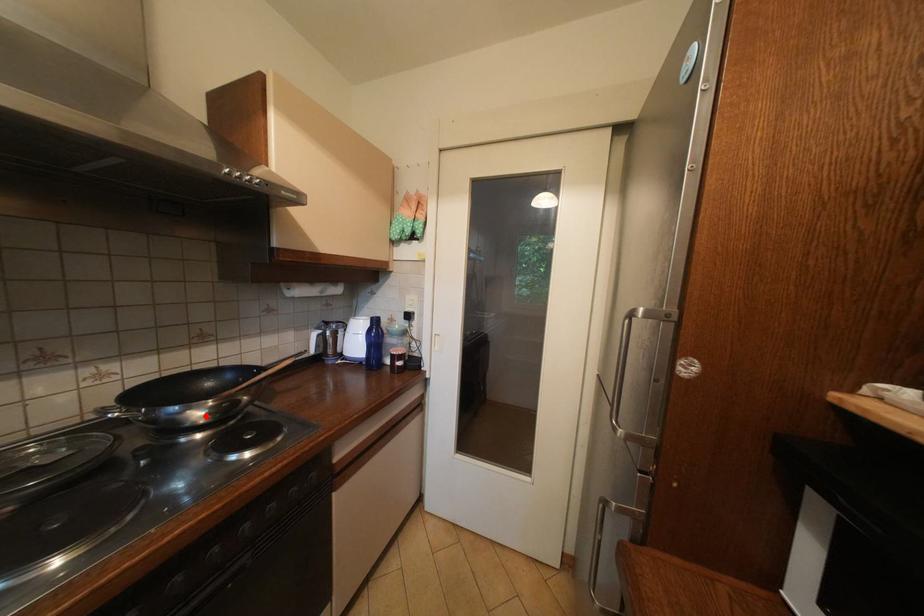
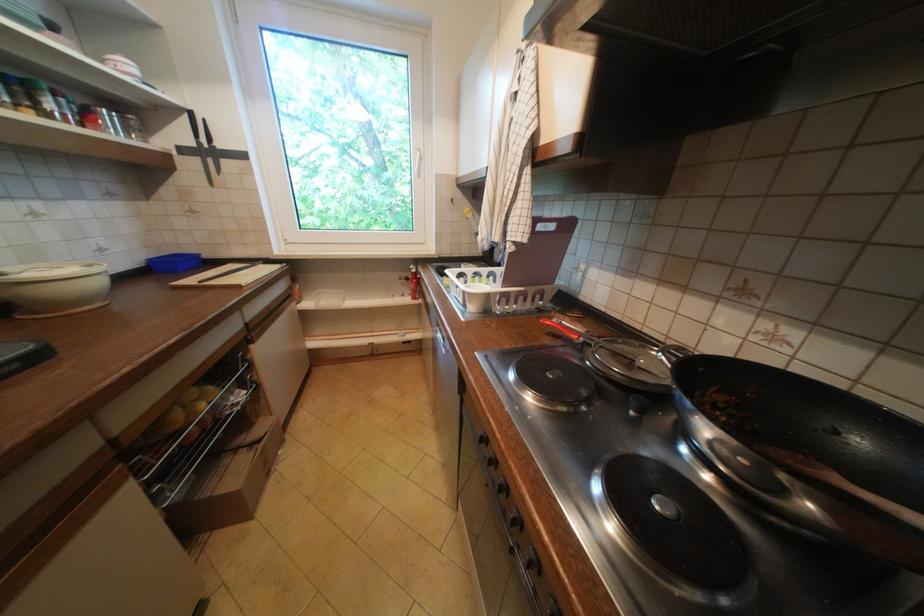
In the second image, find the point that corresponds to the highlighted location in the first image.

(715, 430)